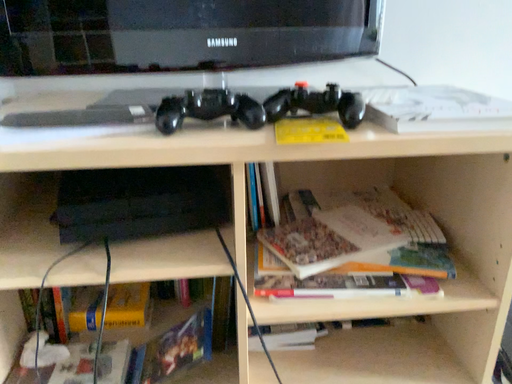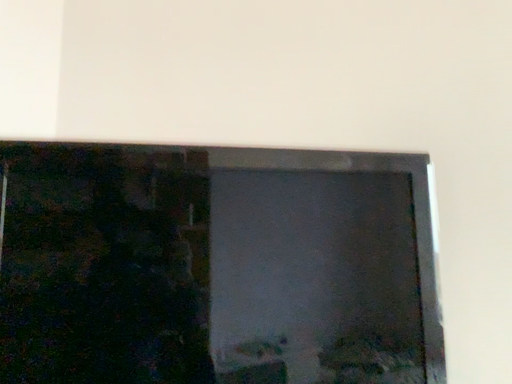
Question: Which way did the camera rotate in the video?

Choices:
 (A) rotated downward
 (B) rotated upward

Answer: (B)